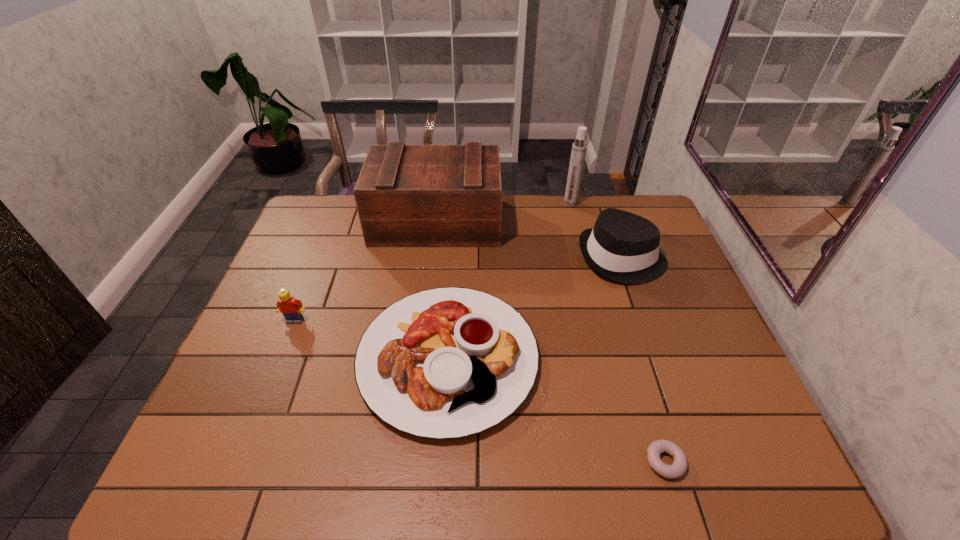
In order to click on vacant area located 0.340m on the front-facing side of the third shortest object in this screenshot , I will do `click(246, 446)`.

Identify the location of vacant region located 0.120m on the right of the fifth tallest object. This screenshot has height=540, width=960. (586, 359).

At what (x,y) coordinates should I click in order to perform the action: click on vacant space situated on the right of the shortest object. Please return your answer as a coordinate pair (x, y). This screenshot has height=540, width=960. Looking at the image, I should click on (770, 462).

Locate an element on the screen. Image resolution: width=960 pixels, height=540 pixels. aerosol can present at the far edge is located at coordinates (579, 147).

Find the location of a particular element. This screenshot has height=540, width=960. box located in the far edge section of the desktop is located at coordinates (406, 195).

Where is `fedora that is at the far edge`? This screenshot has height=540, width=960. fedora that is at the far edge is located at coordinates (622, 246).

The image size is (960, 540). Identify the location of platter at the near edge. (449, 362).

The height and width of the screenshot is (540, 960). Find the location of `doughnut at the near edge`. doughnut at the near edge is located at coordinates (678, 468).

The height and width of the screenshot is (540, 960). In order to click on object that is at the left edge in this screenshot , I will do `click(291, 308)`.

Image resolution: width=960 pixels, height=540 pixels. I want to click on object present at the right edge, so click(x=622, y=246).